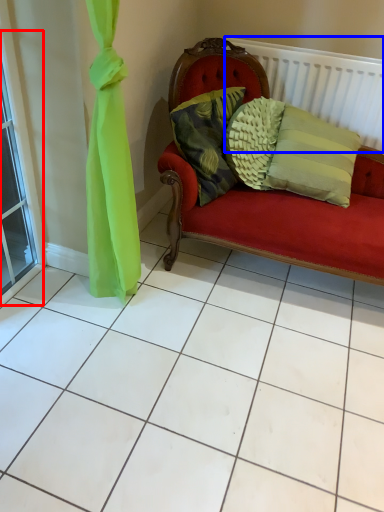
Question: Which of the following is the closest to the observer, window (highlighted by a red box) or balustrade (highlighted by a blue box)?

Choices:
 (A) window
 (B) balustrade

Answer: (A)